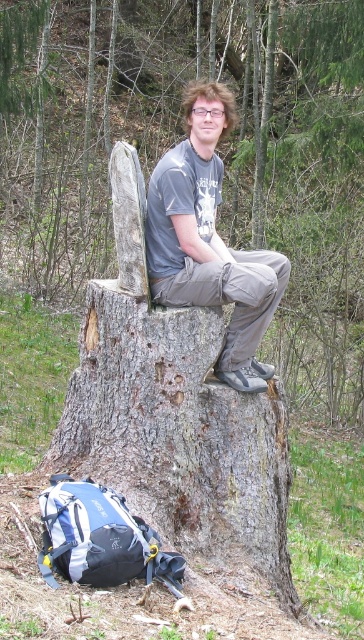
Where is `gray rough bark tree trunk at center`? gray rough bark tree trunk at center is located at coordinates (173, 416).

At what (x,y) coordinates should I click in order to perform the action: click on gray rough bark tree trunk at center. Please return your answer as a coordinate pair (x, y). The width and height of the screenshot is (364, 640). Looking at the image, I should click on (173, 416).

Locate an element on the screen. The height and width of the screenshot is (640, 364). gray rough bark tree trunk at center is located at coordinates (173, 416).

Which of these two, smooth gray tree stump at center or matte gray shirt at center, stands taller?

smooth gray tree stump at center is taller.

Where is `smooth gray tree stump at center`? Image resolution: width=364 pixels, height=640 pixels. smooth gray tree stump at center is located at coordinates coord(219,150).

At what (x,y) coordinates should I click in order to perform the action: click on smooth gray tree stump at center. Please return your answer as a coordinate pair (x, y). Image resolution: width=364 pixels, height=640 pixels. Looking at the image, I should click on (219, 150).

Does point (274, 232) lie behind point (251, 481)?

Yes.

How much distance is there between smooth gray tree stump at center and gray rough bark tree trunk at center?

smooth gray tree stump at center is 10.38 meters from gray rough bark tree trunk at center.

Which is behind, point (351, 305) or point (285, 609)?

The point (351, 305) is more distant.

Find the location of a particular element. smooth gray tree stump at center is located at coordinates (219, 150).